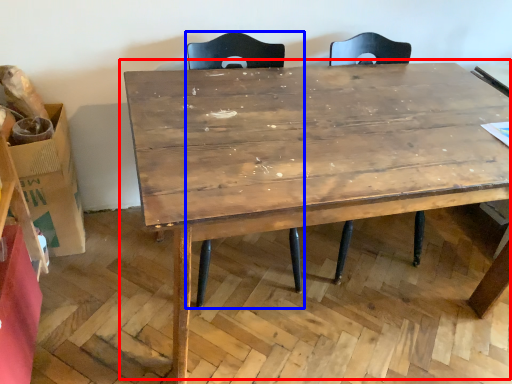
Question: Which object is closer to the camera taking this photo, table (highlighted by a red box) or swivel chair (highlighted by a blue box)?

Choices:
 (A) table
 (B) swivel chair

Answer: (A)